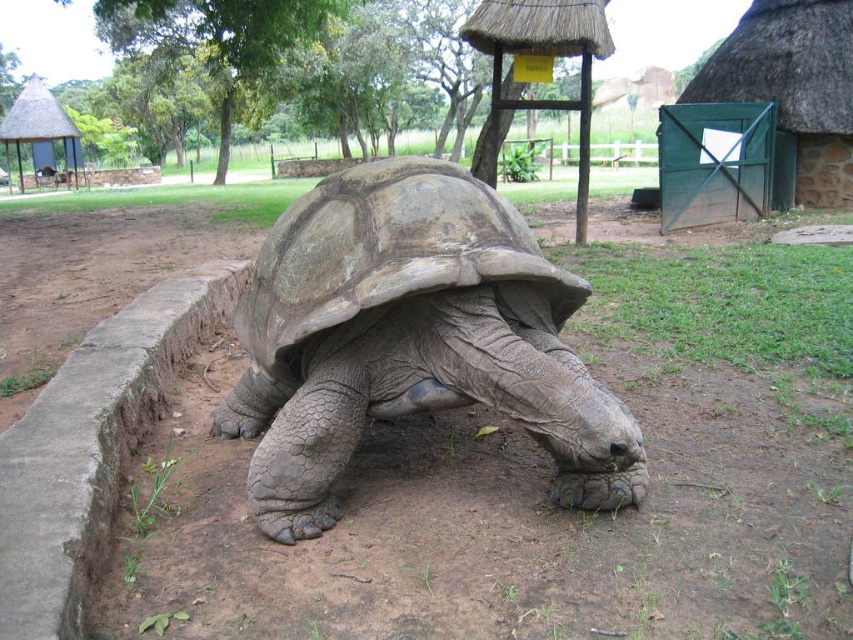
Question: Among these points, which one is nearest to the camera?

Choices:
 (A) (692, 369)
 (B) (32, 92)
 (C) (463, 356)
 (D) (845, 65)

Answer: (C)

Question: Does leathery brown tortoise at center appear under green thatched roof at upper right?

Choices:
 (A) yes
 (B) no

Answer: (A)

Question: Does brown dirt field at center come in front of green thatched roof at upper right?

Choices:
 (A) no
 (B) yes

Answer: (B)

Question: Which point is farther to the camera?

Choices:
 (A) thatched straw hut at upper left
 (B) green thatched roof at upper right

Answer: (A)

Question: Which of the following is the farthest from the observer?

Choices:
 (A) (16, 132)
 (B) (397, 262)

Answer: (A)

Question: Is brown dirt field at center in front of leathery brown tortoise at center?

Choices:
 (A) yes
 (B) no

Answer: (A)